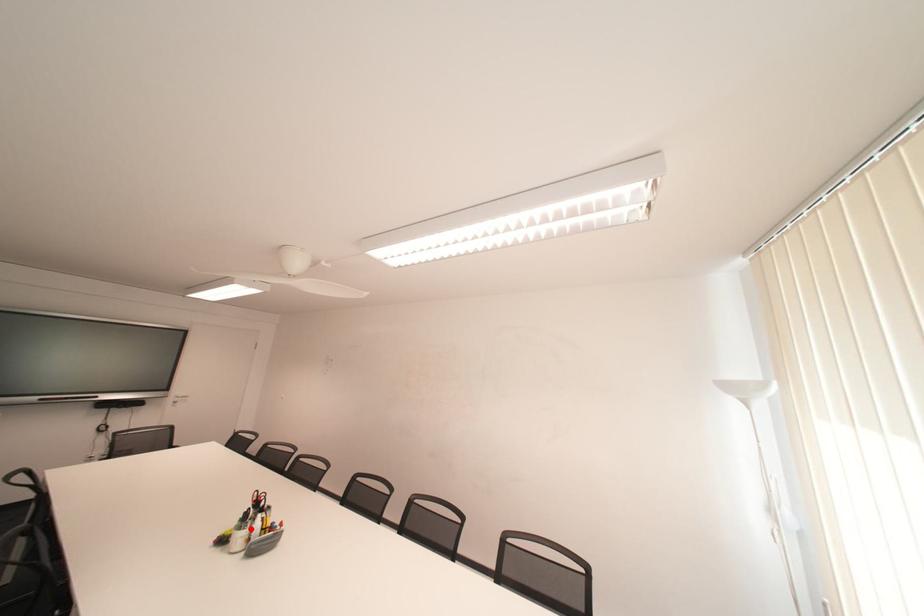
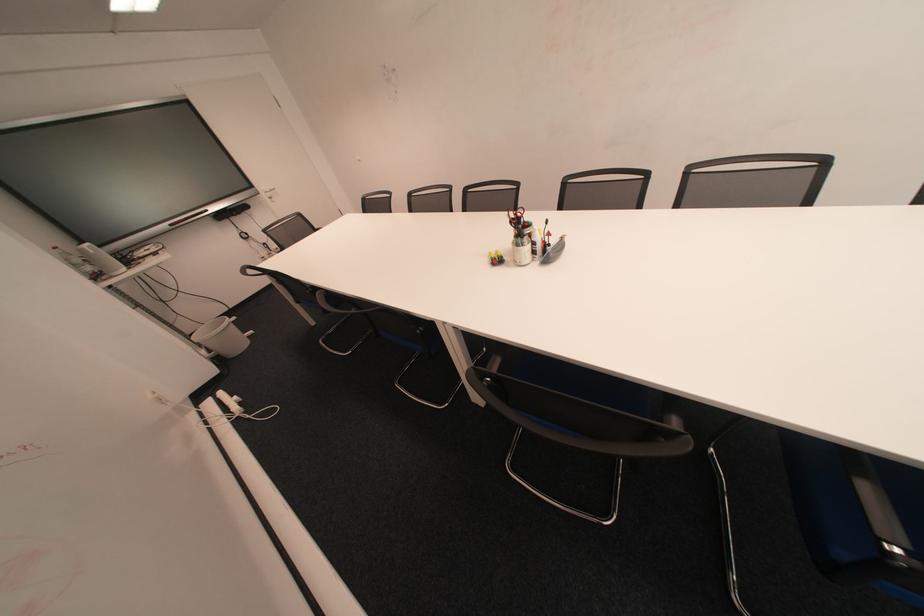
Where in the second image is the point corresponding to the highlighted location from the first image?

(529, 245)